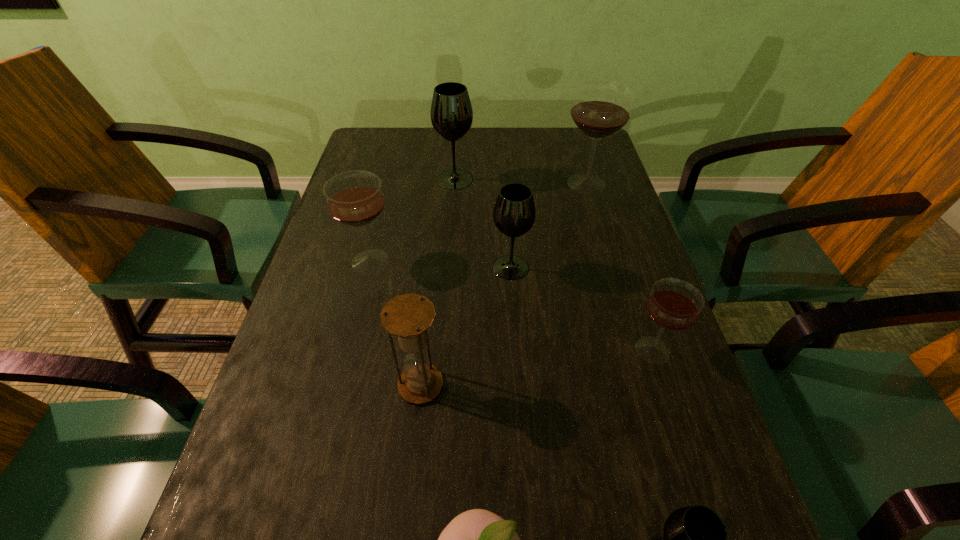
The width and height of the screenshot is (960, 540). What are the coordinates of `free area in between the leftmost object and the biggest red wineglass` in the screenshot? It's located at click(478, 222).

Identify the location of free spot between the brown hourglass and the smallest red wineglass. (537, 367).

Identify the location of free spot between the second nearest wineglass and the farthest red wineglass. (619, 267).

Locate an element on the screen. The image size is (960, 540). vacant region between the brown hourglass and the second farthest gray wineglass is located at coordinates (466, 326).

Identify the location of free point between the biggest red wineglass and the smallest red wineglass. The image size is (960, 540). (619, 267).

Identify the location of unoccupied position between the fifth farthest wineglass and the biggest gray wineglass. Image resolution: width=960 pixels, height=540 pixels. (554, 265).

You are a GUI agent. You are given a task and a screenshot of the screen. Output one action in this format:
    pyautogui.click(x=<x>, y=<y>)
    Task: Click on the empty space between the second nearest wineglass and the biggest red wineglass
    Image resolution: width=960 pixels, height=540 pixels.
    Given the screenshot: What is the action you would take?
    pyautogui.click(x=619, y=267)

Choose which object is the second nearest neighbor to the rightmost gray wineglass. Please provide its 2D coordinates. Your answer should be formatted as a tuple, i.e. [(x, y)], where the tuple contains the x and y coordinates of a point satisfying the conditions above.

[(673, 304)]

Find the location of a particular element. the closest object relative to the brown hourglass is located at coordinates (477, 539).

Find the location of a particular element. Image resolution: width=960 pixels, height=540 pixels. wineglass that stands as the fourth closest to the nearest red wineglass is located at coordinates (354, 198).